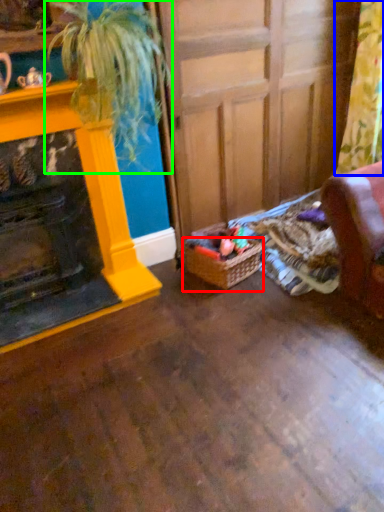
Question: Which object is the farthest from basket (highlighted by a red box)? Choose among these: curtain (highlighted by a blue box) or houseplant (highlighted by a green box).

Choices:
 (A) curtain
 (B) houseplant

Answer: (A)